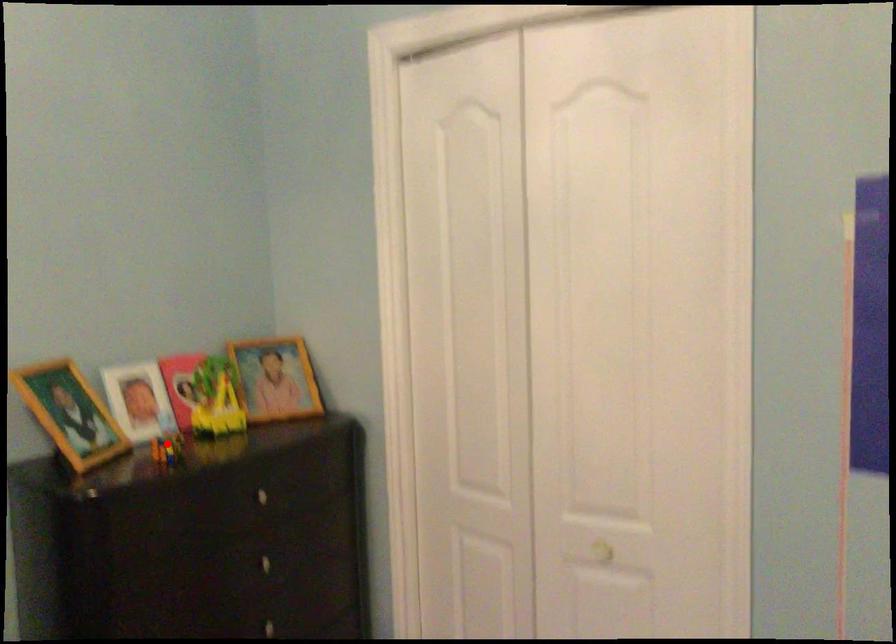
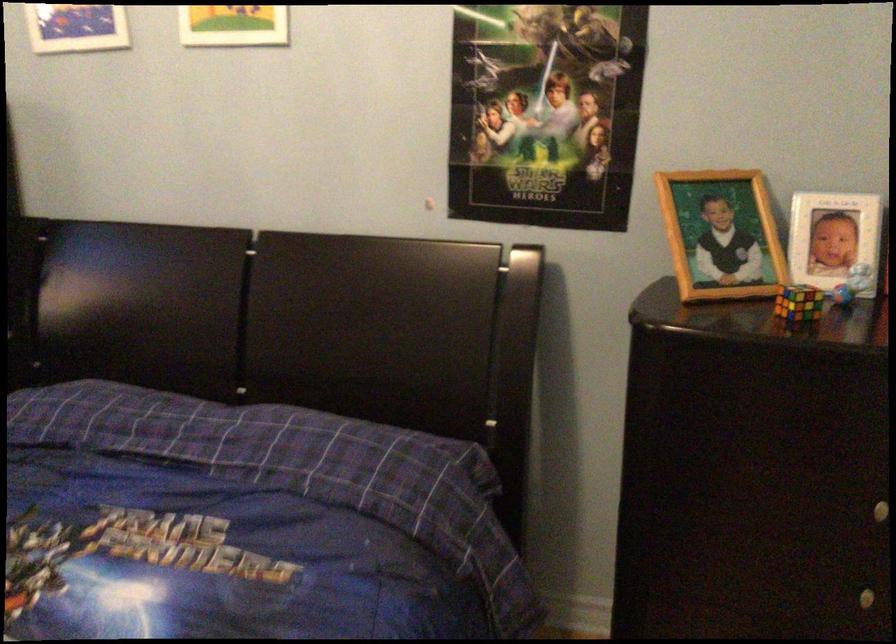
Question: I am providing you with two images of the same scene from different viewpoints. Image1 has a red point marked. In image2, the corresponding 3D location appears at what relative position? Reply with the corresponding letter.

Choices:
 (A) Closer
 (B) Farther

Answer: (A)